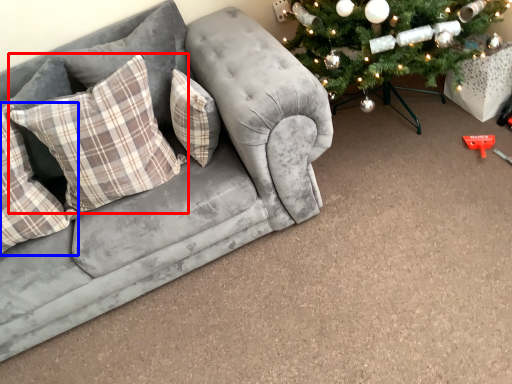
Question: Which object is further to the camera taking this photo, pillow (highlighted by a red box) or pillow (highlighted by a blue box)?

Choices:
 (A) pillow
 (B) pillow

Answer: (A)